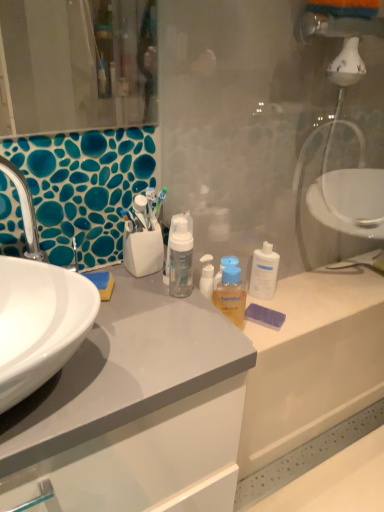
Question: From a real-world perspective, is translucent orange liquid at center under white glossy sink at left?

Choices:
 (A) yes
 (B) no

Answer: (A)

Question: Is translucent orange liquid at center wider than white glossy sink at left?

Choices:
 (A) yes
 (B) no

Answer: (B)

Question: From the image's perspective, does translucent orange liquid at center appear higher than white glossy sink at left?

Choices:
 (A) yes
 (B) no

Answer: (B)

Question: Does translucent orange liquid at center appear on the right side of white glossy sink at left?

Choices:
 (A) no
 (B) yes

Answer: (B)

Question: From the image's perspective, is translucent orange liquid at center beneath white glossy sink at left?

Choices:
 (A) yes
 (B) no

Answer: (A)

Question: Does translucent orange liquid at center have a larger size compared to white glossy sink at left?

Choices:
 (A) yes
 (B) no

Answer: (B)

Question: Does transparent plastic glass door at center appear on the right side of transparent plastic bottle at center?

Choices:
 (A) yes
 (B) no

Answer: (B)

Question: Considering the relative sizes of transparent plastic glass door at center and transparent plastic bottle at center in the image provided, is transparent plastic glass door at center taller than transparent plastic bottle at center?

Choices:
 (A) no
 (B) yes

Answer: (B)

Question: Is there a large distance between transparent plastic glass door at center and transparent plastic bottle at center?

Choices:
 (A) yes
 (B) no

Answer: (B)

Question: Is transparent plastic glass door at center aimed at transparent plastic bottle at center?

Choices:
 (A) yes
 (B) no

Answer: (A)

Question: Is transparent plastic bottle at center completely or partially inside transparent plastic glass door at center?

Choices:
 (A) no
 (B) yes

Answer: (A)

Question: From the image's perspective, would you say transparent plastic glass door at center is shown under transparent plastic bottle at center?

Choices:
 (A) yes
 (B) no

Answer: (A)

Question: Does white glossy sink at left appear on the right side of transparent plastic bottle at center?

Choices:
 (A) no
 (B) yes

Answer: (A)